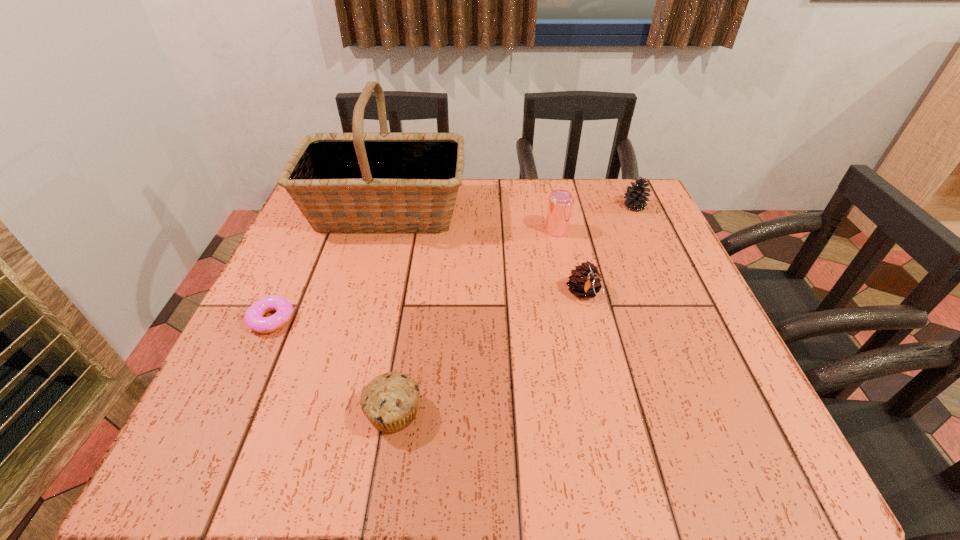
Where is `unoccupied position between the fifth shortest object and the nearer pinecone`? unoccupied position between the fifth shortest object and the nearer pinecone is located at coordinates pos(570,262).

At what (x,y) coordinates should I click in order to perform the action: click on empty space between the right pinecone and the tallest object. Please return your answer as a coordinate pair (x, y). The image size is (960, 540). Looking at the image, I should click on (511, 209).

What are the coordinates of `vacant area that lies between the rightmost object and the nearest object` in the screenshot? It's located at (515, 309).

Identify the location of free area in between the shortest object and the nearest object. (333, 366).

In order to click on free space between the beer can and the rightmost object in this screenshot , I will do pyautogui.click(x=595, y=218).

Find the location of a particular element. The width and height of the screenshot is (960, 540). free space between the doughnut and the rightmost object is located at coordinates (453, 263).

Where is `vacant point located between the tallest object and the shortest object`? The width and height of the screenshot is (960, 540). vacant point located between the tallest object and the shortest object is located at coordinates (329, 265).

Locate which object ranks fifth in proximity to the rightmost object. Please provide its 2D coordinates. Your answer should be formatted as a tuple, i.e. [(x, y)], where the tuple contains the x and y coordinates of a point satisfying the conditions above.

[(254, 319)]

Locate which object ranks in proximity to the right pinecone. Please provide its 2D coordinates. Your answer should be formatted as a tuple, i.e. [(x, y)], where the tuple contains the x and y coordinates of a point satisfying the conditions above.

[(560, 201)]

I want to click on vacant area that satisfies the following two spatial constraints: 1. by the handle of the tallest object; 2. on the right side of the beer can, so click(381, 231).